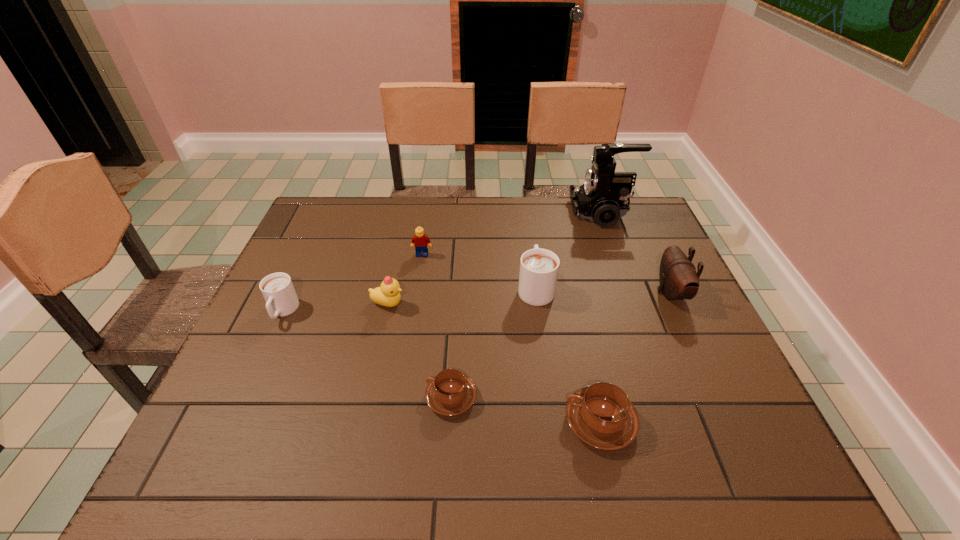
Where is `vacant space situated 0.060m on the side with the handle of the tallest cappuccino`? This screenshot has width=960, height=540. vacant space situated 0.060m on the side with the handle of the tallest cappuccino is located at coordinates (531, 256).

Locate an element on the screen. The image size is (960, 540). free space located on the side with the handle of the tallest cappuccino is located at coordinates (529, 238).

Find the location of a particular element. vacant region located on the side with the handle of the tallest cappuccino is located at coordinates (529, 238).

Where is `vacant region located 0.240m on the front-facing side of the yellow Lego`? Image resolution: width=960 pixels, height=540 pixels. vacant region located 0.240m on the front-facing side of the yellow Lego is located at coordinates (413, 318).

Where is `vacant position located on the front-facing side of the yellow duckling`? The image size is (960, 540). vacant position located on the front-facing side of the yellow duckling is located at coordinates (444, 304).

Find the location of a particular element. The width and height of the screenshot is (960, 540). vacant space located on the side with the handle of the smaller white cappuccino is located at coordinates (223, 443).

You are a GUI agent. You are given a task and a screenshot of the screen. Output one action in this format:
    pyautogui.click(x=<x>, y=<y>)
    Task: Click on the blank space located on the side of the second shortest cappuccino with the handle
    This screenshot has width=960, height=540.
    Given the screenshot: What is the action you would take?
    pyautogui.click(x=418, y=422)

Locate an element on the screen. free spot located on the side of the second shortest cappuccino with the handle is located at coordinates (471, 422).

Where is `vacant space situated on the side of the second shortest cappuccino with the handle`? Image resolution: width=960 pixels, height=540 pixels. vacant space situated on the side of the second shortest cappuccino with the handle is located at coordinates (403, 422).

Identify the location of free space located on the side of the second cappuccino from left to right with the handle. (402, 397).